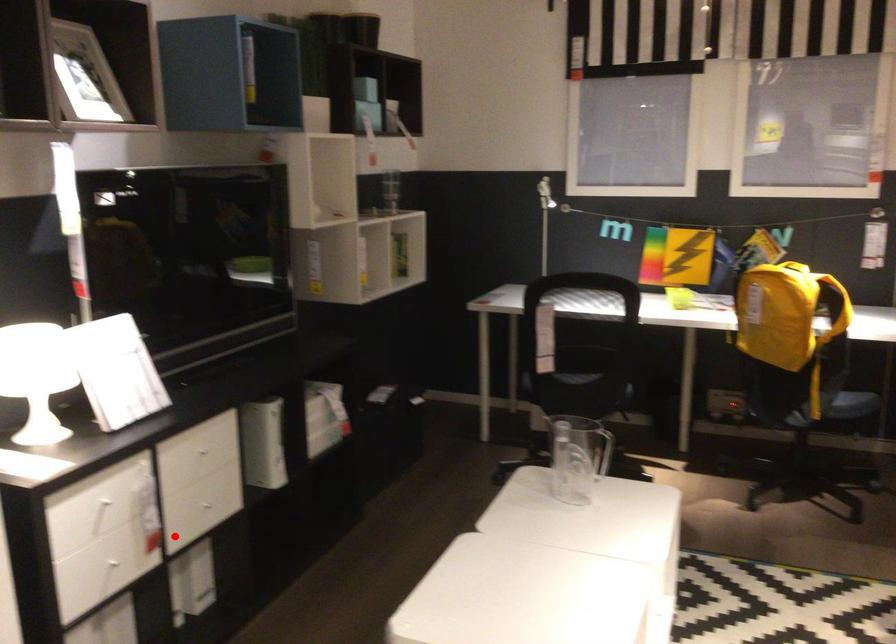
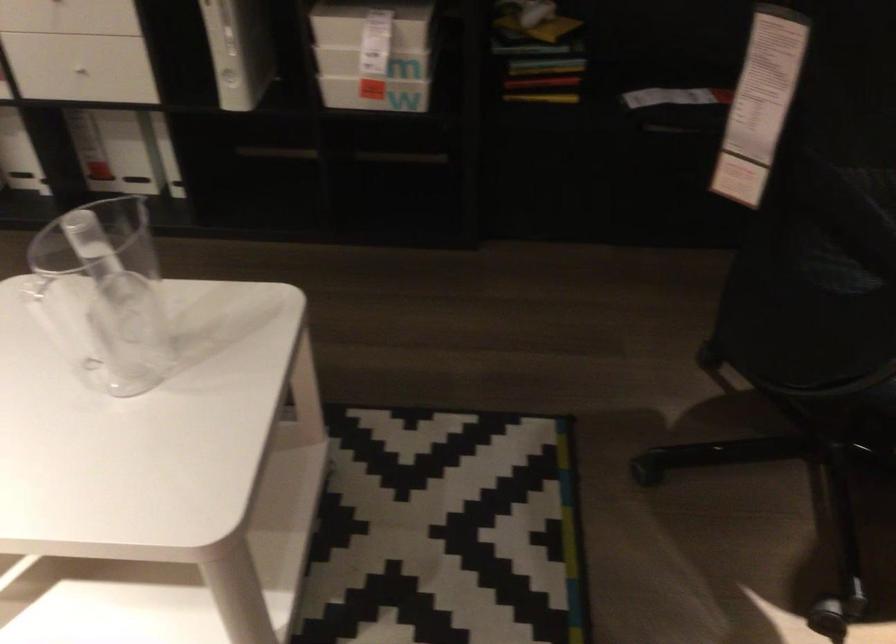
Where in the second image is the point corresponding to the highlighted location from the first image?

(75, 77)